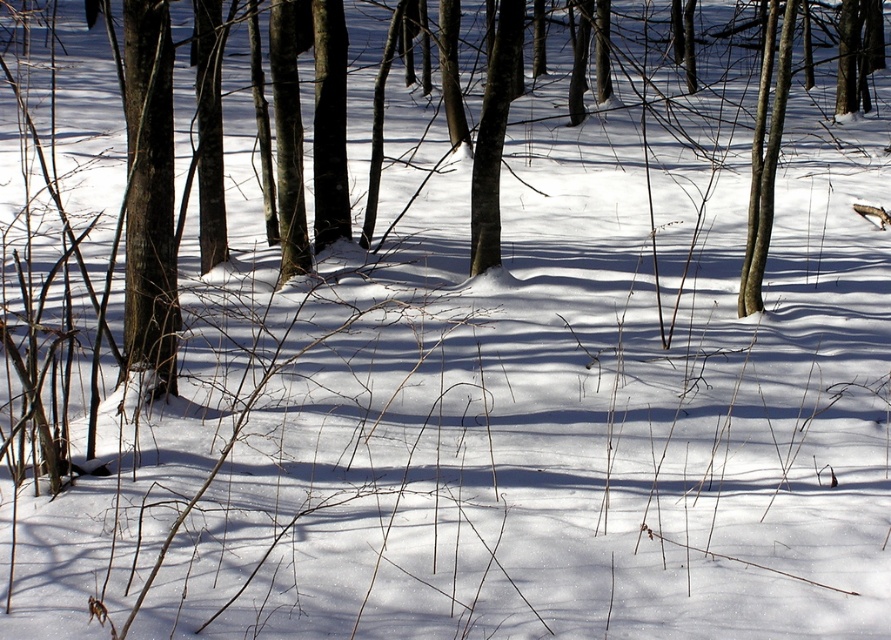
You are a hiker who wants to take a photo of the smooth bark tree at left and the smooth bark tree at center. Which tree should you stand closer to in order to capture both in a single frame?

You should stand closer to the smooth bark tree at left because it is positioned below the smooth bark tree at center, allowing both to be captured in the frame when closer to the lower one.

You are standing in the forest looking at the smooth bark tree at left and the smooth bark tree at upper right. Which tree would appear larger to you if both are the same size?

The smooth bark tree at left would appear larger because it is closer to the viewer than the smooth bark tree at upper right, making it look bigger in size.

You are standing at the center of the forest clearing and want to locate the smooth bark tree at left. According to the coordinates provided, in which direction should you look to find it?

The smooth bark tree at left is located at coordinates point (149, 195), which is to the left side of the scene. Therefore, you should look to the left to find it.